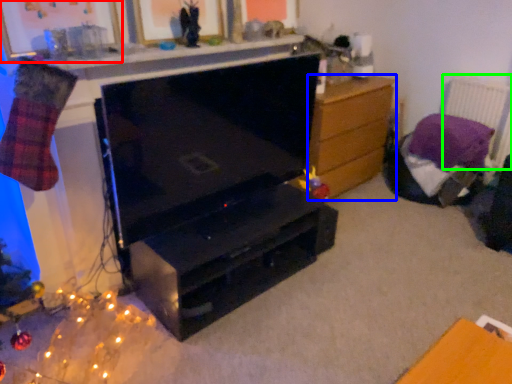
Question: Based on their relative distances, which object is nearer to picture frame (highlighted by a red box)? Choose from chest of drawers (highlighted by a blue box) and radiator (highlighted by a green box).

Choices:
 (A) chest of drawers
 (B) radiator

Answer: (A)